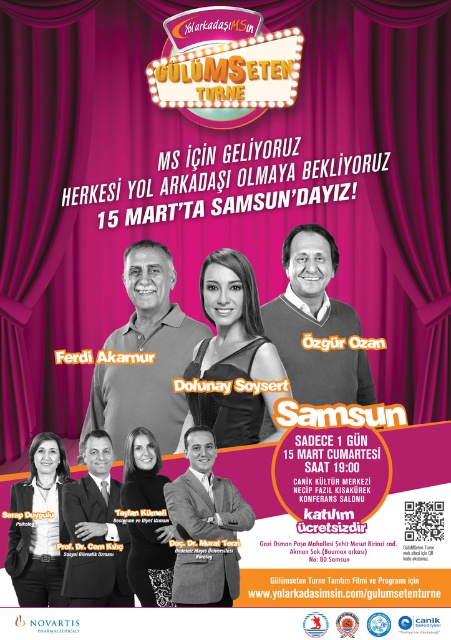
Which of these two, dark brown suit at center or black textured dress at center, stands shorter?

Standing shorter between the two is dark brown suit at center.

Is dark brown suit at center above black textured dress at center?

No, dark brown suit at center is not above black textured dress at center.

Is point (119, 528) behind point (156, 493)?

No, it is not.

The height and width of the screenshot is (640, 451). What are the coordinates of `dark brown suit at center` in the screenshot? It's located at pos(96,531).

Does matte black shirt at center have a greater height compared to black textured dress at center?

Indeed, matte black shirt at center has a greater height compared to black textured dress at center.

Between point (156, 324) and point (138, 486), which one is positioned in front?

Point (138, 486) is in front.

Identify the location of matte black shirt at center. (145, 352).

Is point (217, 256) farther from viewer compared to point (145, 598)?

Yes, point (217, 256) is behind point (145, 598).

Which is in front, point (201, 412) or point (150, 488)?

Point (150, 488) is in front.

What do you see at coordinates (233, 324) in the screenshot? The image size is (451, 640). I see `matte black hair at center` at bounding box center [233, 324].

I want to click on matte black hair at center, so click(x=233, y=324).